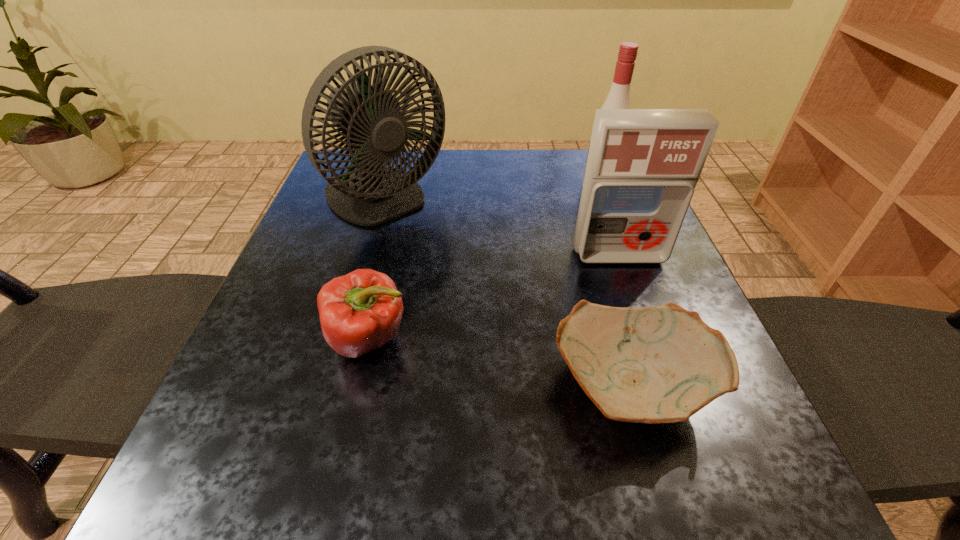
Identify the location of vacant region that satisfies the following two spatial constraints: 1. on the label of the alcohol; 2. in front of the fan to direct airflow. Image resolution: width=960 pixels, height=540 pixels. (605, 201).

I want to click on vacant space that satisfies the following two spatial constraints: 1. on the label of the alcohol; 2. in front of the fan to direct airflow, so click(x=605, y=201).

I want to click on free space that satisfies the following two spatial constraints: 1. in front of the pottery to direct airflow; 2. on the left side of the fan, so click(333, 386).

You are a GUI agent. You are given a task and a screenshot of the screen. Output one action in this format:
    pyautogui.click(x=<x>, y=<y>)
    Task: Click on the vacant space that satisfies the following two spatial constraints: 1. on the label of the alcohol; 2. on the front-facing side of the third nearest object
    The width and height of the screenshot is (960, 540).
    Given the screenshot: What is the action you would take?
    pyautogui.click(x=625, y=256)